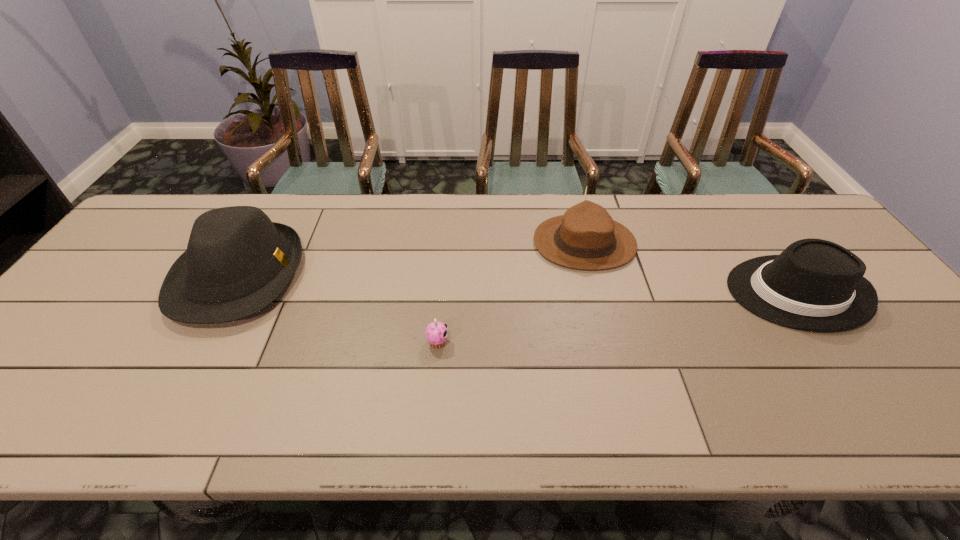
Where is `blank area at the far right corner`? This screenshot has width=960, height=540. blank area at the far right corner is located at coordinates (804, 215).

Where is `free area in between the rightmost object and the third object from right to left`? free area in between the rightmost object and the third object from right to left is located at coordinates click(617, 318).

The image size is (960, 540). Find the location of `empty space between the cupcake and the rightmost object`. empty space between the cupcake and the rightmost object is located at coordinates (x=617, y=318).

Locate an element on the screen. empty space between the tallest fedora and the shortest object is located at coordinates (339, 309).

Identify the location of vacant area that lies between the leftmost fedora and the second fedora from left to right. The height and width of the screenshot is (540, 960). (412, 259).

Image resolution: width=960 pixels, height=540 pixels. I want to click on free spot between the rightmost fedora and the second object from right to left, so click(691, 268).

Image resolution: width=960 pixels, height=540 pixels. In order to click on vacant point located between the second fedora from right to left and the rightmost object in this screenshot , I will do `click(691, 268)`.

At what (x,y) coordinates should I click in order to perform the action: click on free space that is in between the rightmost fedora and the second object from right to left. Please return your answer as a coordinate pair (x, y). This screenshot has height=540, width=960. Looking at the image, I should click on (691, 268).

Find the location of a particular element. The height and width of the screenshot is (540, 960). empty space between the third object from left to right and the rightmost object is located at coordinates (691, 268).

Where is `unoccupied position between the cupcake and the rightmost object`? The height and width of the screenshot is (540, 960). unoccupied position between the cupcake and the rightmost object is located at coordinates (617, 318).